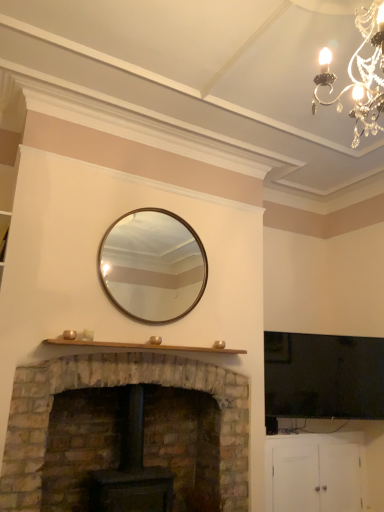
Question: From a real-world perspective, is rustic stone fireplace at lower left on white matte cabinet at lower right?

Choices:
 (A) no
 (B) yes

Answer: (B)

Question: Is rustic stone fireplace at lower left wider than white matte cabinet at lower right?

Choices:
 (A) no
 (B) yes

Answer: (B)

Question: From a real-world perspective, is rustic stone fireplace at lower left under white matte cabinet at lower right?

Choices:
 (A) no
 (B) yes

Answer: (A)

Question: Is white matte cabinet at lower right a part of rustic stone fireplace at lower left?

Choices:
 (A) no
 (B) yes

Answer: (A)

Question: Can you confirm if rustic stone fireplace at lower left is positioned to the right of white matte cabinet at lower right?

Choices:
 (A) yes
 (B) no

Answer: (B)

Question: Is rustic stone fireplace at lower left positioned with its back to white matte cabinet at lower right?

Choices:
 (A) yes
 (B) no

Answer: (B)

Question: Is rustic stone fireplace at lower left not within crystal chandelier at upper right?

Choices:
 (A) yes
 (B) no

Answer: (A)

Question: From a real-world perspective, is rustic stone fireplace at lower left positioned under crystal chandelier at upper right based on gravity?

Choices:
 (A) no
 (B) yes

Answer: (B)

Question: From the image's perspective, is rustic stone fireplace at lower left on crystal chandelier at upper right?

Choices:
 (A) yes
 (B) no

Answer: (B)

Question: Is rustic stone fireplace at lower left thinner than crystal chandelier at upper right?

Choices:
 (A) yes
 (B) no

Answer: (B)

Question: From the image's perspective, would you say rustic stone fireplace at lower left is shown under crystal chandelier at upper right?

Choices:
 (A) no
 (B) yes

Answer: (B)

Question: Is there a large distance between rustic stone fireplace at lower left and crystal chandelier at upper right?

Choices:
 (A) yes
 (B) no

Answer: (A)

Question: Is crystal chandelier at upper right smaller than rustic stone fireplace at lower left?

Choices:
 (A) no
 (B) yes

Answer: (B)